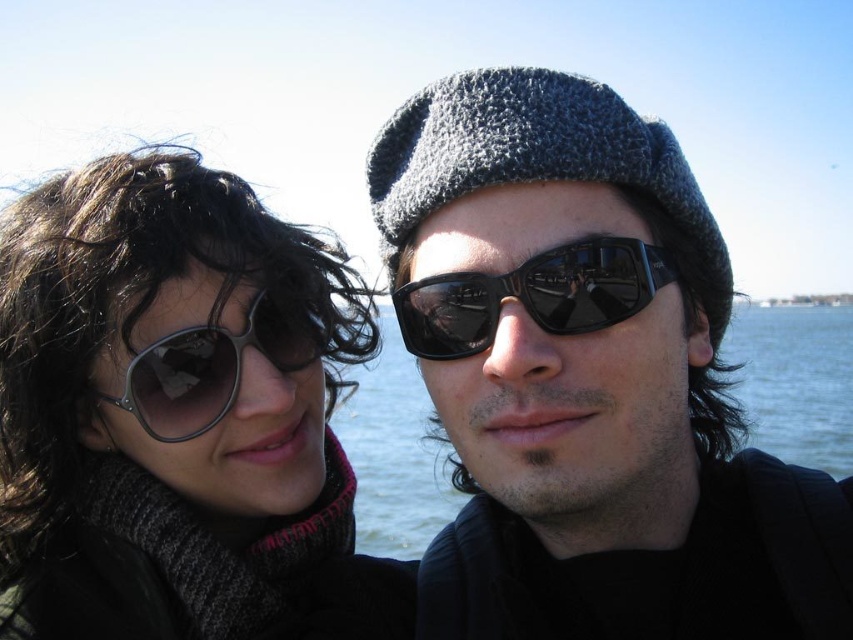
Question: Is matte gray knit cap at upper center bigger than black reflective sunglasses at center?

Choices:
 (A) yes
 (B) no

Answer: (A)

Question: Where is gray knitted beanie at center located in relation to blue water at center in the image?

Choices:
 (A) above
 (B) below

Answer: (A)

Question: Which of the following is the closest to the observer?

Choices:
 (A) blue water at center
 (B) black reflective sunglasses at center
 (C) gray knitted beanie at center

Answer: (B)

Question: Estimate the real-world distances between objects in this image. Which object is farther from the matte black sunglasses at left?

Choices:
 (A) metallic reflective sunglasses at left
 (B) gray knitted beanie at center
 (C) matte gray knit cap at upper center
 (D) blue water at center

Answer: (D)

Question: Which of these objects is positioned farthest from the metallic reflective sunglasses at left?

Choices:
 (A) matte gray knit cap at upper center
 (B) matte black sunglasses at left
 (C) blue water at center
 (D) black reflective sunglasses at center

Answer: (C)

Question: In this image, where is blue water at center located relative to metallic reflective sunglasses at left?

Choices:
 (A) left
 (B) right

Answer: (B)